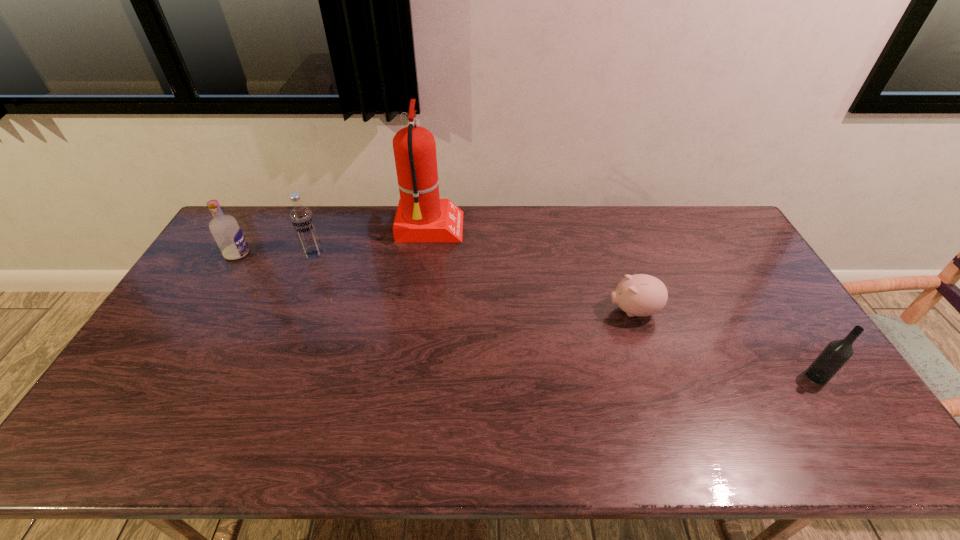
In the image, there is a desktop. Identify the location of vacant region at the left edge. This screenshot has height=540, width=960. (179, 309).

This screenshot has width=960, height=540. In the image, there is a desktop. Find the location of `vacant space at the right edge`. vacant space at the right edge is located at coordinates (799, 334).

Image resolution: width=960 pixels, height=540 pixels. In order to click on free space at the far left corner of the desktop in this screenshot , I will do `click(260, 211)`.

The width and height of the screenshot is (960, 540). In the image, there is a desktop. Identify the location of free region at the far right corner. (706, 211).

Where is `vacant area at the near right corner`? vacant area at the near right corner is located at coordinates (856, 445).

The width and height of the screenshot is (960, 540). Identify the location of free space between the fourth object from right to left and the leftmost vodka. (276, 253).

Identify the location of free space between the nearest object and the second nearest object. The image size is (960, 540). (725, 343).

The height and width of the screenshot is (540, 960). Find the location of `vacant area that lies between the third object from right to left and the leftmost object`. vacant area that lies between the third object from right to left and the leftmost object is located at coordinates (334, 241).

Where is `free spot between the fourth farthest object and the nearest object`? Image resolution: width=960 pixels, height=540 pixels. free spot between the fourth farthest object and the nearest object is located at coordinates (725, 343).

Locate an element on the screen. The width and height of the screenshot is (960, 540). free area in between the nearest vodka and the second vodka from right to left is located at coordinates (565, 314).